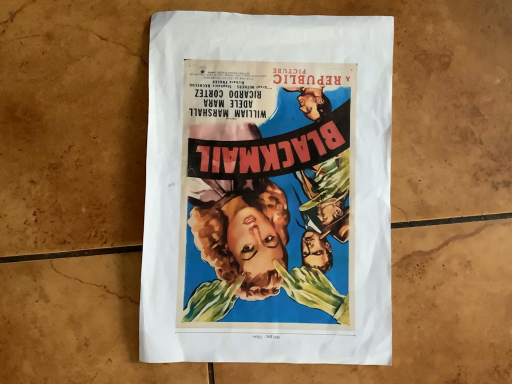
This screenshot has height=384, width=512. I want to click on empty space that is ontop of vibrant paper poster at center (from a real-world perspective), so click(x=270, y=174).